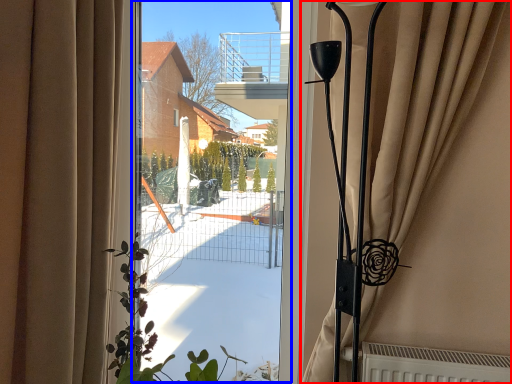
Question: Which object appears closest to the camera in this image, curtain (highlighted by a red box) or window screen (highlighted by a blue box)?

Choices:
 (A) curtain
 (B) window screen

Answer: (A)